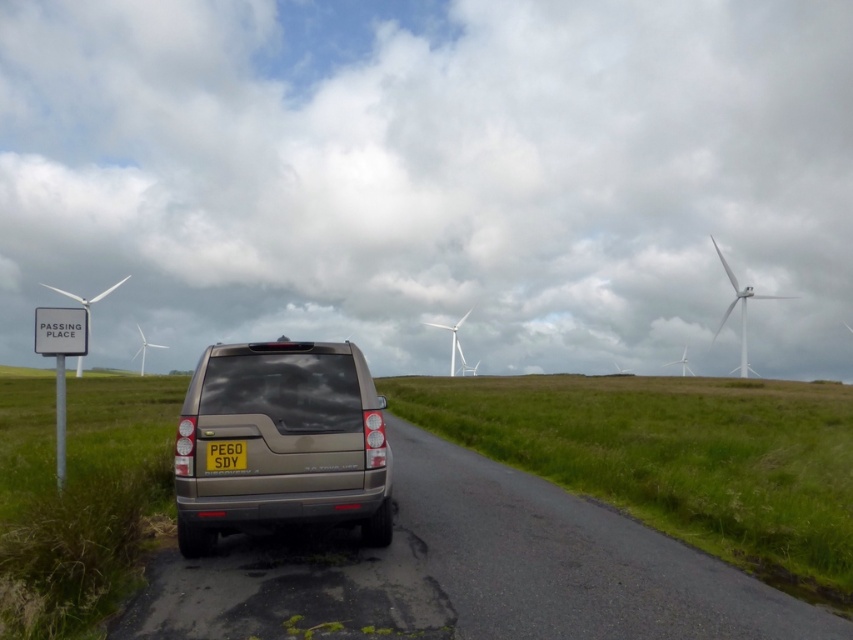
Question: Can you confirm if white plastic wind turbine at center is thinner than white matte windmill at center?

Choices:
 (A) yes
 (B) no

Answer: (B)

Question: Based on their relative distances, which object is farther from the white matte wind turbine at right?

Choices:
 (A) gold metallic suv at center
 (B) yellow matte license plate at center
 (C) white plastic wind turbine at center

Answer: (B)

Question: Is yellow matte license plate at center closer to camera compared to white matte windmill at center?

Choices:
 (A) yes
 (B) no

Answer: (A)

Question: Which point is farther from the camera taking this photo?

Choices:
 (A) (142, 362)
 (B) (369, 451)
 (C) (741, 337)

Answer: (A)

Question: Among these objects, which one is farthest from the camera?

Choices:
 (A) white matte windmill at center
 (B) gold metallic suv at center
 (C) white matte wind turbine at right
 (D) white plastic wind turbine at center

Answer: (A)

Question: Does gold metallic suv at center have a lesser width compared to white matte windmill at center?

Choices:
 (A) yes
 (B) no

Answer: (A)